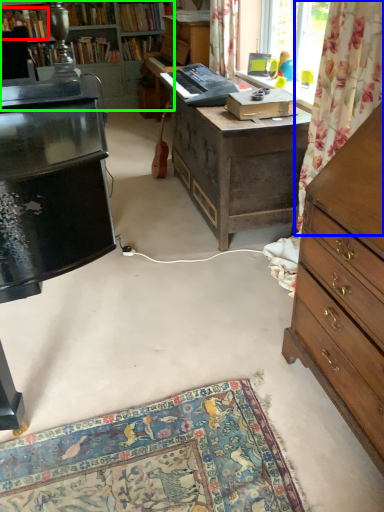
Question: Estimate the real-world distances between objects in this image. Which object is farther from book (highlighted by a red box), tapestry (highlighted by a blue box) or cabinetry (highlighted by a green box)?

Choices:
 (A) tapestry
 (B) cabinetry

Answer: (A)